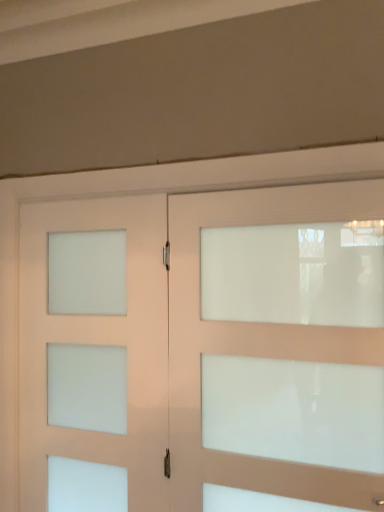
Question: Is point tap(238, 475) positioned closer to the camera than point tap(130, 406)?

Choices:
 (A) farther
 (B) closer

Answer: (B)

Question: In the image, is white frosted glass door at center, which appears as the 2th door when viewed from the left, positioned in front of or behind white frosted glass door at left, which ranks as the 2th door in right-to-left order?

Choices:
 (A) behind
 (B) front

Answer: (B)

Question: In terms of height, does white frosted glass door at center, which appears as the 2th door when viewed from the left, look taller or shorter compared to white frosted glass door at left, the 1th door positioned from the left?

Choices:
 (A) tall
 (B) short

Answer: (B)

Question: Visually, is white frosted glass door at left, which ranks as the 2th door in right-to-left order, positioned to the left or to the right of white frosted glass door at center, acting as the first door starting from the right?

Choices:
 (A) right
 (B) left

Answer: (B)

Question: Is white frosted glass door at left, which ranks as the 2th door in right-to-left order, wider or thinner than white frosted glass door at center, which appears as the 2th door when viewed from the left?

Choices:
 (A) wide
 (B) thin

Answer: (B)

Question: Is white frosted glass door at left, the 1th door positioned from the left, inside or outside of white frosted glass door at center, which appears as the 2th door when viewed from the left?

Choices:
 (A) inside
 (B) outside

Answer: (B)

Question: From the image's perspective, is white frosted glass door at left, the 1th door positioned from the left, above or below white frosted glass door at center, acting as the first door starting from the right?

Choices:
 (A) below
 (B) above

Answer: (A)